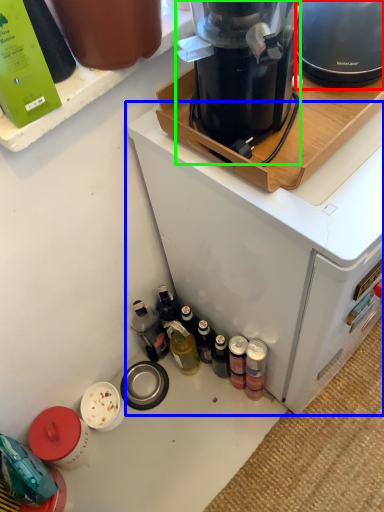
Question: Which object is the closest to the kitchen appliance (highlighted by a red box)? Choose among these: home appliance (highlighted by a blue box) or kitchen appliance (highlighted by a green box).

Choices:
 (A) home appliance
 (B) kitchen appliance

Answer: (B)